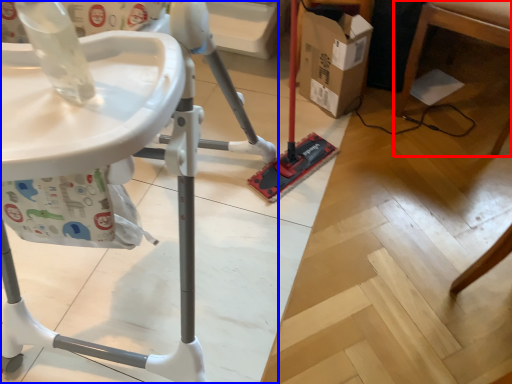
Question: Which object is further to the camera taking this photo, furniture (highlighted by a red box) or furniture (highlighted by a blue box)?

Choices:
 (A) furniture
 (B) furniture

Answer: (A)